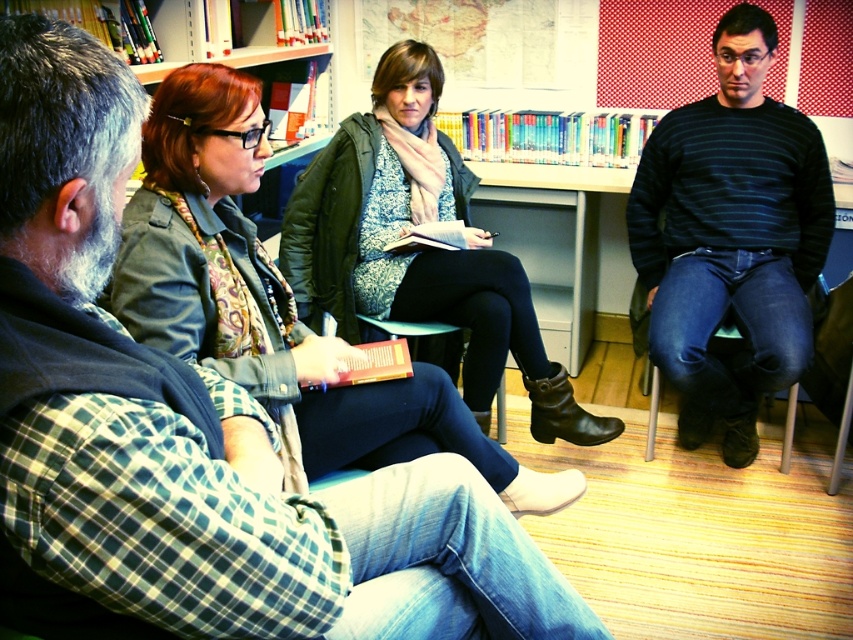
Who is higher up, dark blue striped sweater at right or dark blue fabric chair at right?

Positioned higher is dark blue striped sweater at right.

Who is taller, dark blue striped sweater at right or dark blue fabric chair at right?

dark blue striped sweater at right

This screenshot has width=853, height=640. What do you see at coordinates (730, 237) in the screenshot? I see `dark blue striped sweater at right` at bounding box center [730, 237].

Where is `dark blue striped sweater at right`? This screenshot has height=640, width=853. dark blue striped sweater at right is located at coordinates 730,237.

Does matte black jacket at center lie behind dark blue fabric chair at right?

No, matte black jacket at center is closer to the viewer.

Is point (462, 202) closer to viewer compared to point (654, 410)?

No, (462, 202) is behind (654, 410).

Identify the location of matte black jacket at center. (419, 250).

Can you confirm if matte green jacket at upper left is positioned to the left of dark blue striped sweater at right?

Indeed, matte green jacket at upper left is positioned on the left side of dark blue striped sweater at right.

What do you see at coordinates (274, 305) in the screenshot? Image resolution: width=853 pixels, height=640 pixels. I see `matte green jacket at upper left` at bounding box center [274, 305].

The image size is (853, 640). Describe the element at coordinates (274, 305) in the screenshot. I see `matte green jacket at upper left` at that location.

You are a GUI agent. You are given a task and a screenshot of the screen. Output one action in this format:
    pyautogui.click(x=<x>, y=<y>)
    Task: Click on the matte green jacket at upper left
    
    Given the screenshot: What is the action you would take?
    pyautogui.click(x=274, y=305)